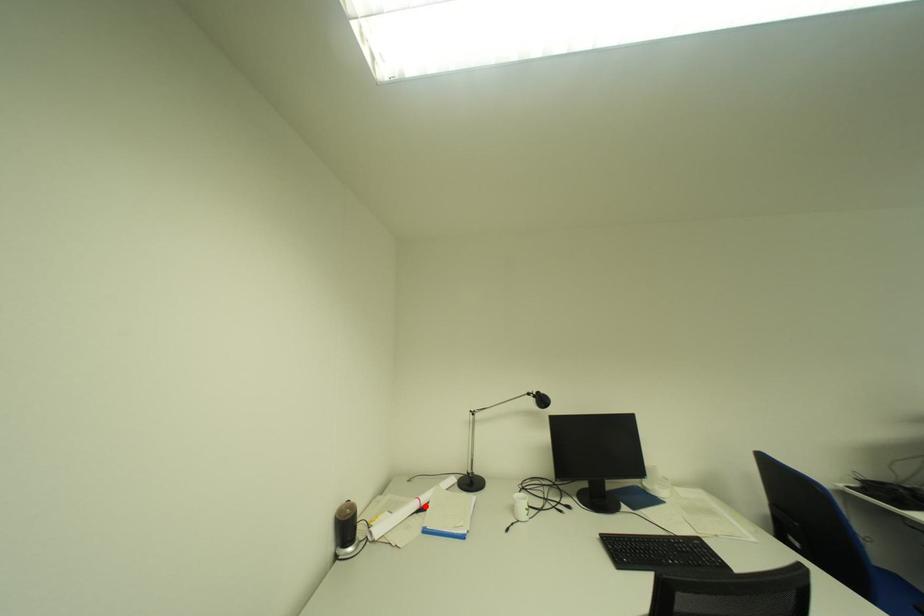
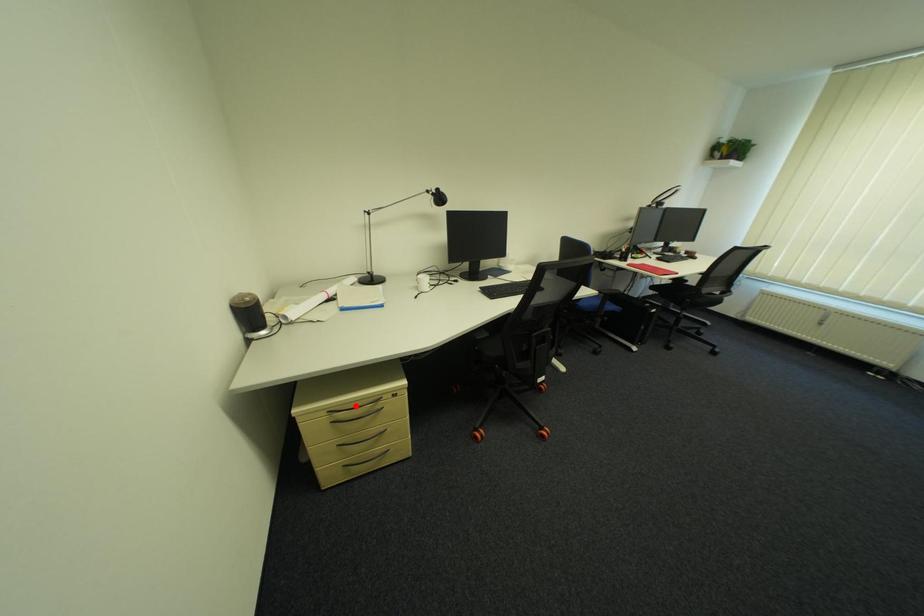
I am providing you with two images of the same scene from different viewpoints. A red point is marked on the first image and another point is marked on the second image. Is the red point in image1 aligned with the point shown in image2?

No